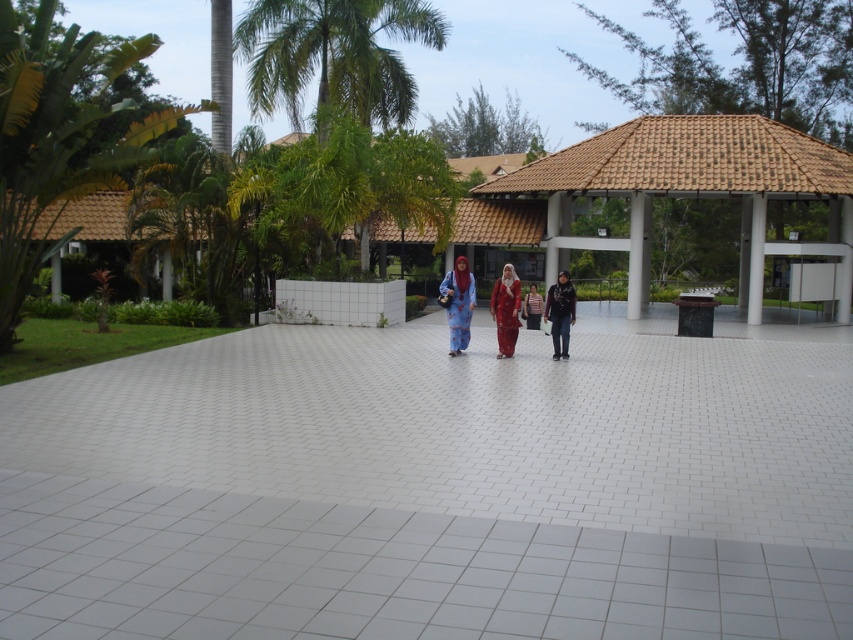
Is white tile path at center above green leafy palm tree at left?

Actually, white tile path at center is below green leafy palm tree at left.

Is the position of white tile path at center less distant than that of green leafy palm tree at left?

Yes, it is in front of green leafy palm tree at left.

Between point (55, 576) and point (62, 52), which one is positioned behind?

Positioned behind is point (62, 52).

This screenshot has height=640, width=853. What are the coordinates of `white tile path at center` in the screenshot? It's located at (434, 486).

Is matte red dress at center thinner than striped shirt at center?

No.

Is point (514, 300) less distant than point (534, 289)?

Yes, point (514, 300) is in front of point (534, 289).

Is point (514, 278) positioned after point (529, 307)?

No, (514, 278) is in front of (529, 307).

You are a GUI agent. You are given a task and a screenshot of the screen. Output one action in this format:
    pyautogui.click(x=<x>, y=<y>)
    Task: Click on the matte red dress at center
    Image resolution: width=853 pixels, height=640 pixels.
    Given the screenshot: What is the action you would take?
    pyautogui.click(x=505, y=308)

Does brown tile roof hut at center have a greater height compared to green leafy palm tree at upper left?

No.

Is brown tile roof hut at center below green leafy palm tree at upper left?

Yes, brown tile roof hut at center is below green leafy palm tree at upper left.

Is point (531, 163) behind point (280, 93)?

No, it is not.

I want to click on brown tile roof hut at center, so click(686, 184).